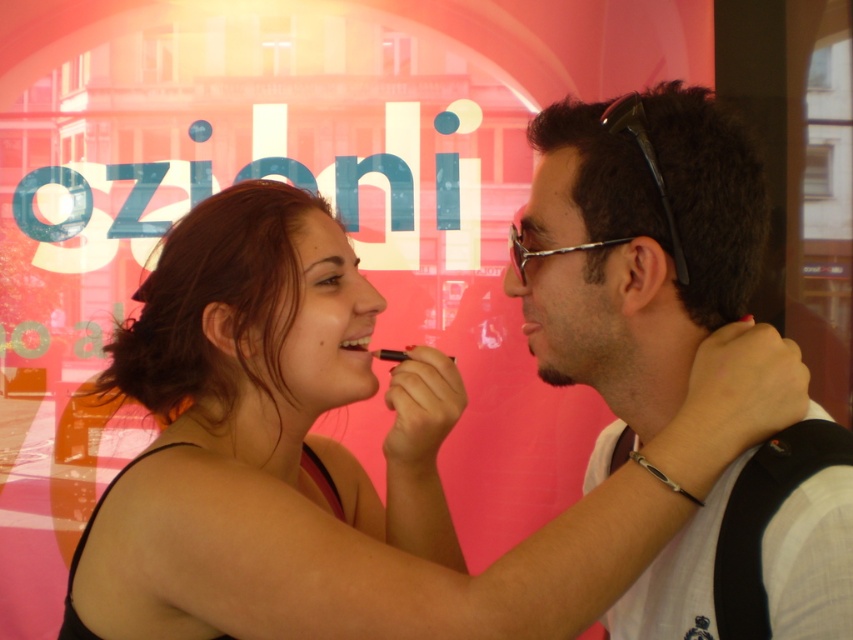
You are a photographer trying to capture a closeup shot of the smooth skin girl at center and the matte white shirt at center. Which one should you zoom in on to ensure both fit in the frame without cropping?

The smooth skin girl at center is wider than the matte white shirt at center, so you should zoom in on the smooth skin girl at center to ensure both fit in the frame without cropping.

You are a photographer trying to capture a closeup of the smooth skin girl at center and the matte black lipstick at center. Which object should you focus on first to ensure both are in sharp focus?

The smooth skin girl at center is closer to the viewer than the matte black lipstick at center, so you should focus on the smooth skin girl at center first to ensure both are in sharp focus.

You are a photographer trying to capture a portrait of the smooth skin girl at center and the matte white shirt at center. Since the background has a reflective surface, you need to ensure that both subjects are clearly visible. Based on their positions, which subject is closer to the camera and thus less likely to be obscured by the reflection?

The smooth skin girl at center is in front of the matte white shirt at center, so she is closer to the camera and less likely to be obscured by the reflection.